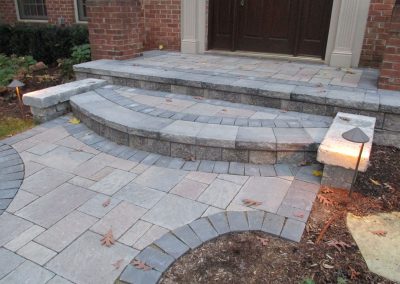
Find the location of `light`. light is located at coordinates (351, 141), (16, 83).